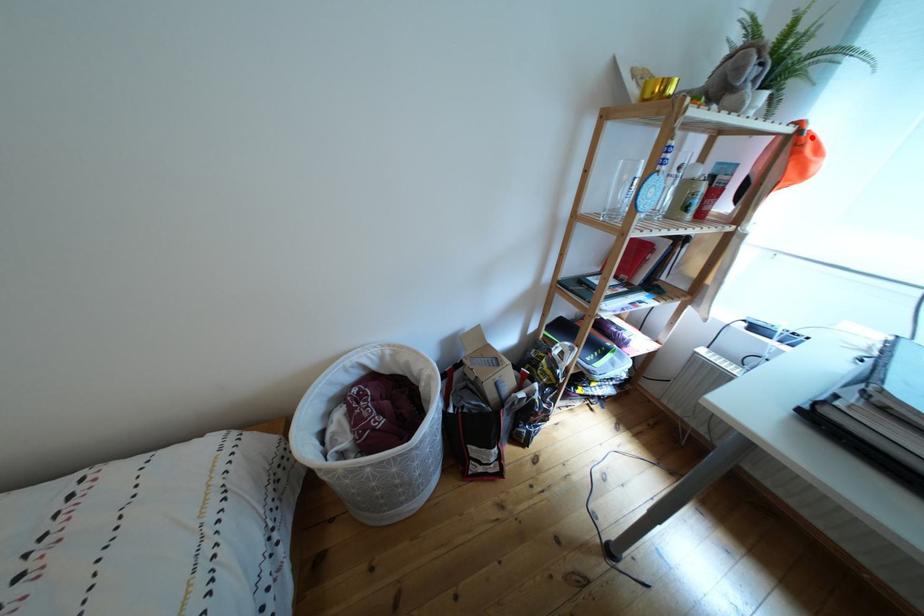
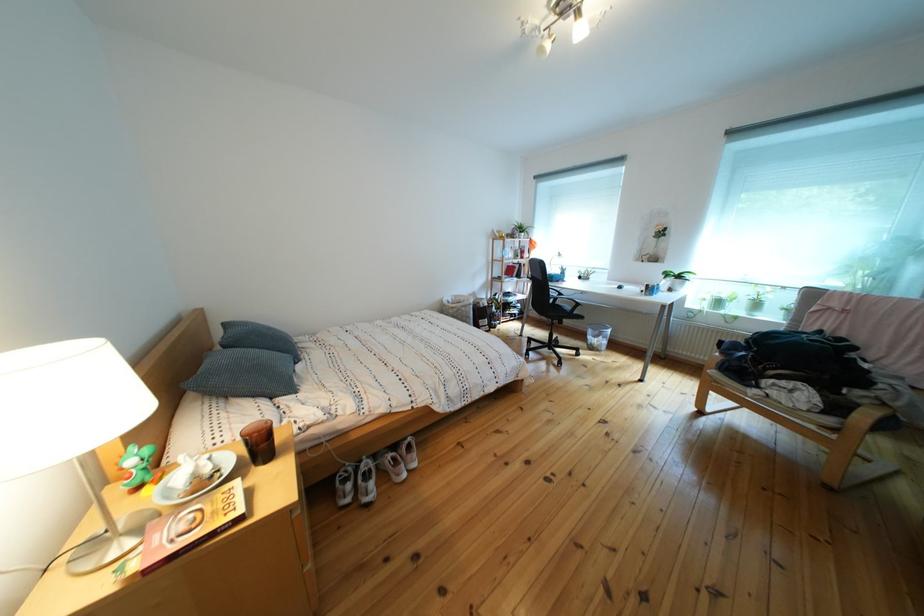
Question: I am providing you with two images of the same scene from different viewpoints. A red point is marked on the first image. Can you still see the location of the red point in image 2?

Choices:
 (A) Yes
 (B) No

Answer: (B)